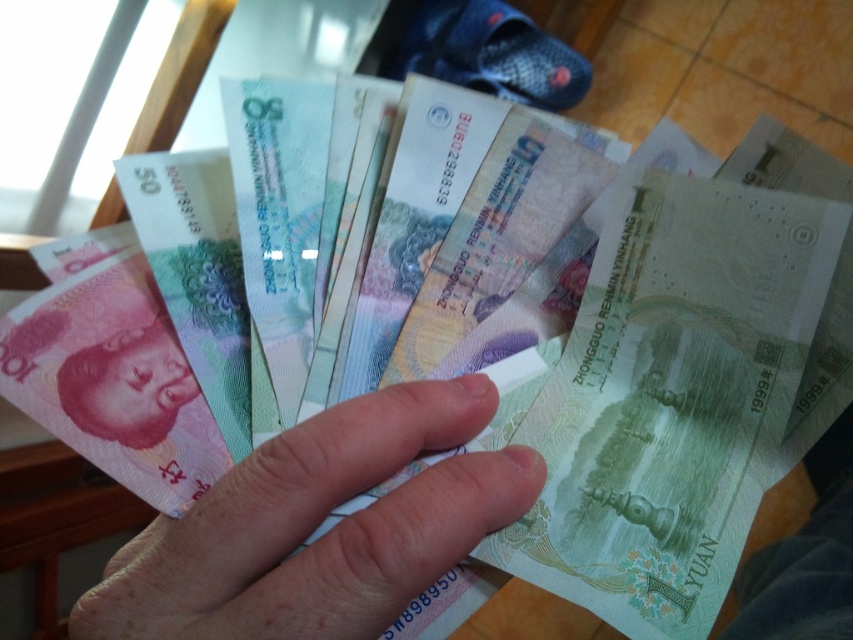
Question: Which point is closer to the camera taking this photo?

Choices:
 (A) (413, 483)
 (B) (74, 369)

Answer: (A)

Question: Does smooth skin hand at center have a larger size compared to matte paper money at lower left?

Choices:
 (A) yes
 (B) no

Answer: (A)

Question: Considering the relative positions of smooth skin hand at center and matte paper money at lower left in the image provided, where is smooth skin hand at center located with respect to matte paper money at lower left?

Choices:
 (A) below
 (B) above

Answer: (A)

Question: Is smooth skin hand at center thinner than matte paper money at lower left?

Choices:
 (A) no
 (B) yes

Answer: (A)